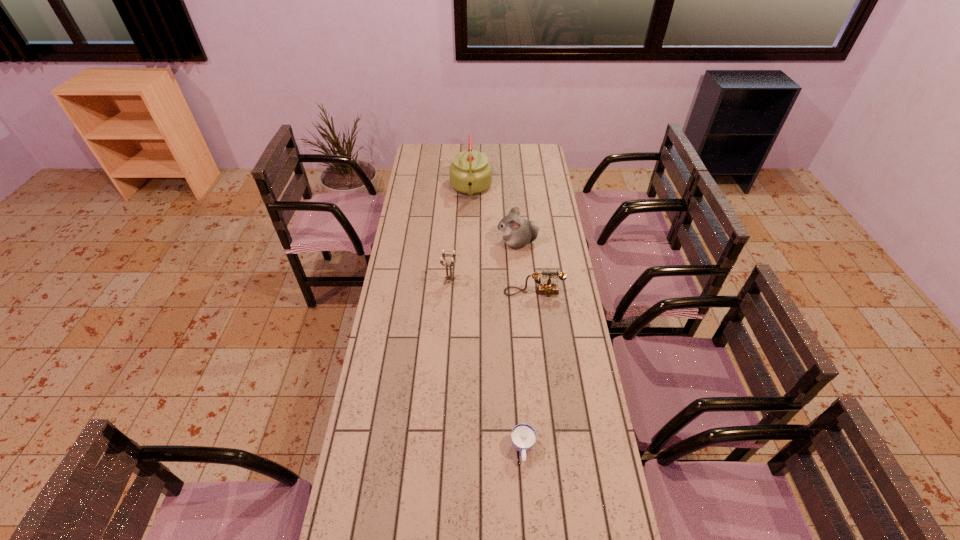
Where is `vacant point located between the shortest object and the candle holder`? vacant point located between the shortest object and the candle holder is located at coordinates (486, 365).

In order to click on free space between the third farthest object and the second farthest object in this screenshot , I will do `click(484, 262)`.

Locate an element on the screen. Image resolution: width=960 pixels, height=540 pixels. blank region between the telephone and the shortest object is located at coordinates (528, 370).

Locate an element on the screen. This screenshot has height=540, width=960. free space between the candle holder and the nearest object is located at coordinates (486, 365).

The width and height of the screenshot is (960, 540). Identify the location of object identified as the closest to the farthest object. (517, 232).

Locate which object ranks third in proximity to the hamster. Please provide its 2D coordinates. Your answer should be formatted as a tuple, i.e. [(x, y)], where the tuple contains the x and y coordinates of a point satisfying the conditions above.

[(449, 277)]